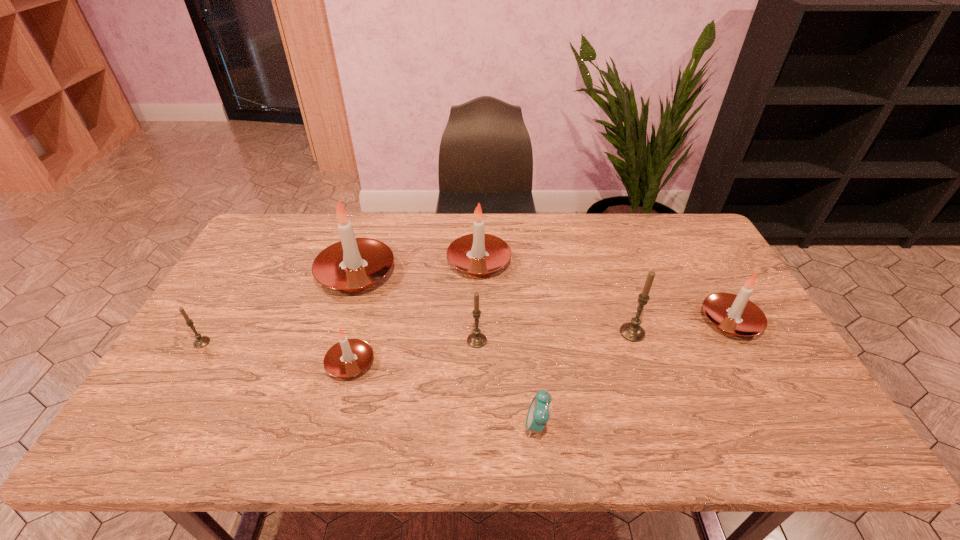
Find the location of a particular element. The height and width of the screenshot is (540, 960). vacant point located between the second biggest gray candle and the nearest white candle is located at coordinates (414, 352).

Where is `free space between the third smallest white candle and the third biggest white candle`? free space between the third smallest white candle and the third biggest white candle is located at coordinates click(x=605, y=292).

The height and width of the screenshot is (540, 960). In order to click on free space that is in between the shortest object and the second smallest gray candle in this screenshot , I will do `click(507, 383)`.

At what (x,y) coordinates should I click in order to perform the action: click on vacant area that lies between the leftmost object and the nearest object. Please return your answer as a coordinate pair (x, y). Looking at the image, I should click on (370, 384).

Find the location of a particular element. The width and height of the screenshot is (960, 540). unoccupied position between the second object from right to left and the second gray candle from left to right is located at coordinates (555, 336).

Where is `vacant space in between the nearest white candle and the second candle from right to left`? Image resolution: width=960 pixels, height=540 pixels. vacant space in between the nearest white candle and the second candle from right to left is located at coordinates (492, 348).

Image resolution: width=960 pixels, height=540 pixels. I want to click on empty location between the nearest white candle and the second gray candle from right to left, so click(414, 352).

Where is `empty space between the nearest white candle and the third white candle from left to right`? The width and height of the screenshot is (960, 540). empty space between the nearest white candle and the third white candle from left to right is located at coordinates (415, 312).

At what (x,y) coordinates should I click in order to perform the action: click on vacant area between the sixth object from left to right and the biggest white candle. Please return your answer as a coordinate pair (x, y). Looking at the image, I should click on (446, 349).

Locate an element on the screen. vacant area between the nearest white candle and the second biggest gray candle is located at coordinates (414, 352).